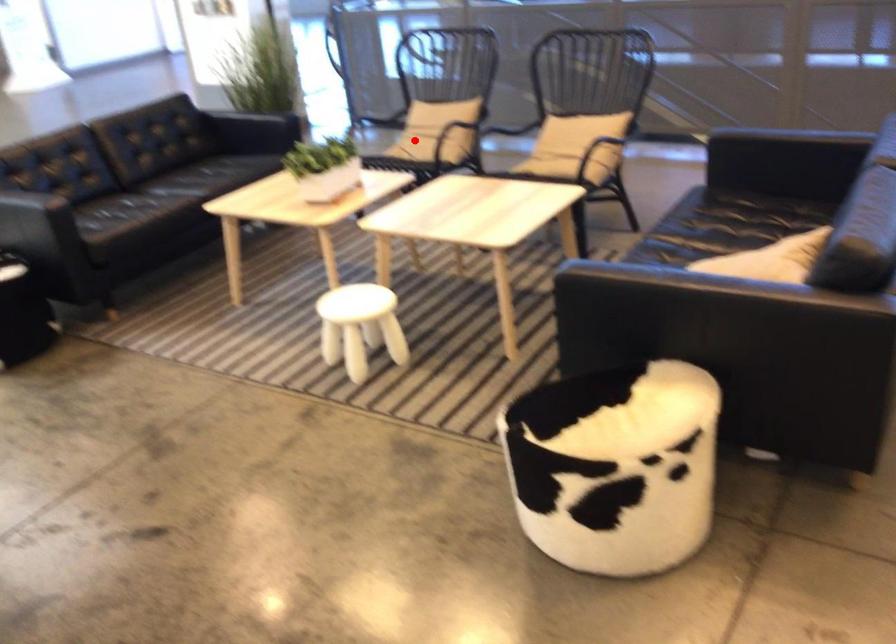
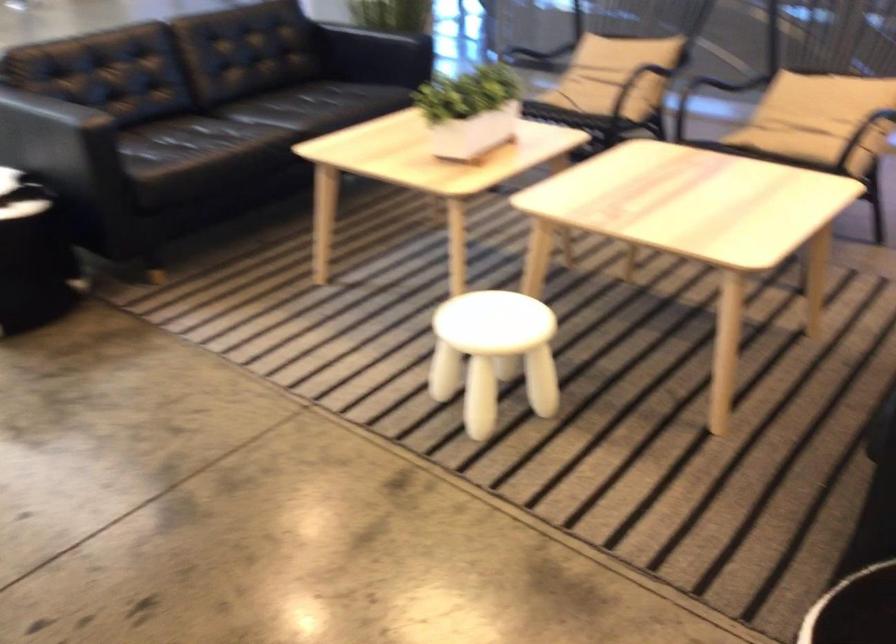
Question: I am providing you with two images of the same scene from different viewpoints. In image1, a red point is highlighted. Considering the same 3D point in image2, which of the following is correct?

Choices:
 (A) It is closer
 (B) It is farther

Answer: (A)